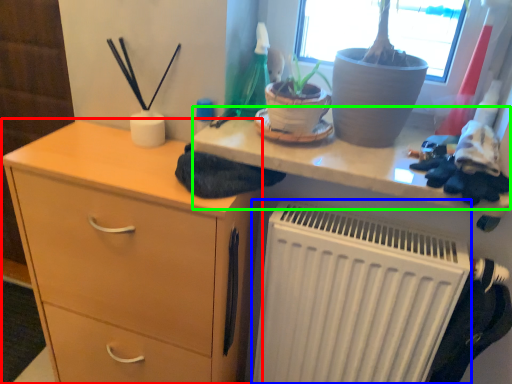
Question: Considering the real-world distances, which object is closest to chest of drawers (highlighted by a red box)? radiator (highlighted by a blue box) or writing desk (highlighted by a green box).

Choices:
 (A) radiator
 (B) writing desk

Answer: (A)